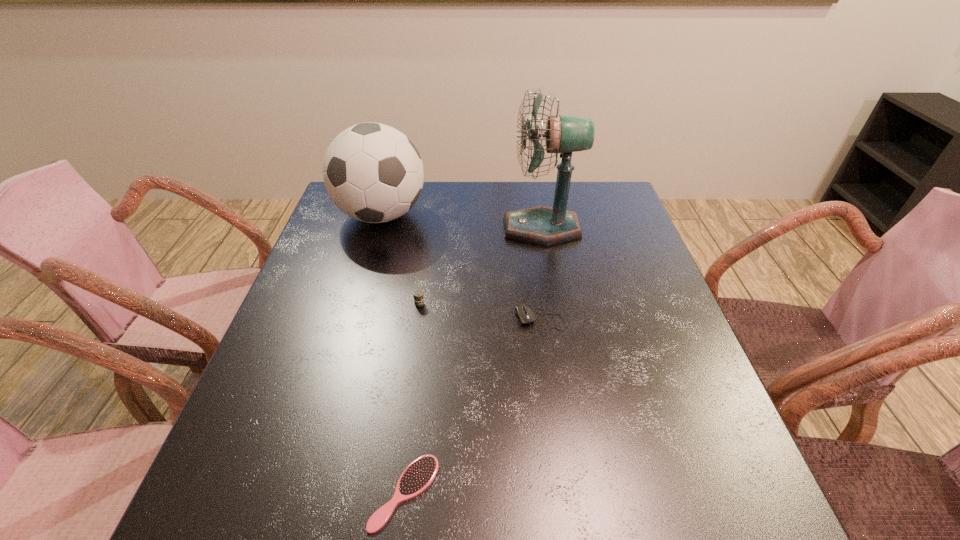
I want to click on vacant region at the far edge of the desktop, so click(520, 193).

What are the coordinates of `free space at the near edge of the desktop` in the screenshot? It's located at (578, 515).

At what (x,y) coordinates should I click in order to perform the action: click on free space at the left edge of the desktop. Please return your answer as a coordinate pair (x, y). Image resolution: width=960 pixels, height=540 pixels. Looking at the image, I should click on (293, 453).

Find the location of a particular element. The height and width of the screenshot is (540, 960). vacant space at the right edge is located at coordinates (650, 273).

Image resolution: width=960 pixels, height=540 pixels. Find the location of `vacant area at the near left corner`. vacant area at the near left corner is located at coordinates (300, 488).

I want to click on free point at the near right corner, so click(x=733, y=508).

Where is `free point between the beer can and the tallest object`? The height and width of the screenshot is (540, 960). free point between the beer can and the tallest object is located at coordinates (481, 266).

Find the location of `empty space between the fan and the hairbrush`. empty space between the fan and the hairbrush is located at coordinates 473,360.

You are a GUI agent. You are given a task and a screenshot of the screen. Output one action in this format:
    pyautogui.click(x=<x>, y=<y>)
    Task: Click on the free spot between the tallest object and the second tallest object
    This screenshot has width=960, height=540.
    Given the screenshot: What is the action you would take?
    pyautogui.click(x=462, y=222)

Where is `vacant point located between the third shortest object and the fourth shortest object`? This screenshot has height=540, width=960. vacant point located between the third shortest object and the fourth shortest object is located at coordinates (400, 260).